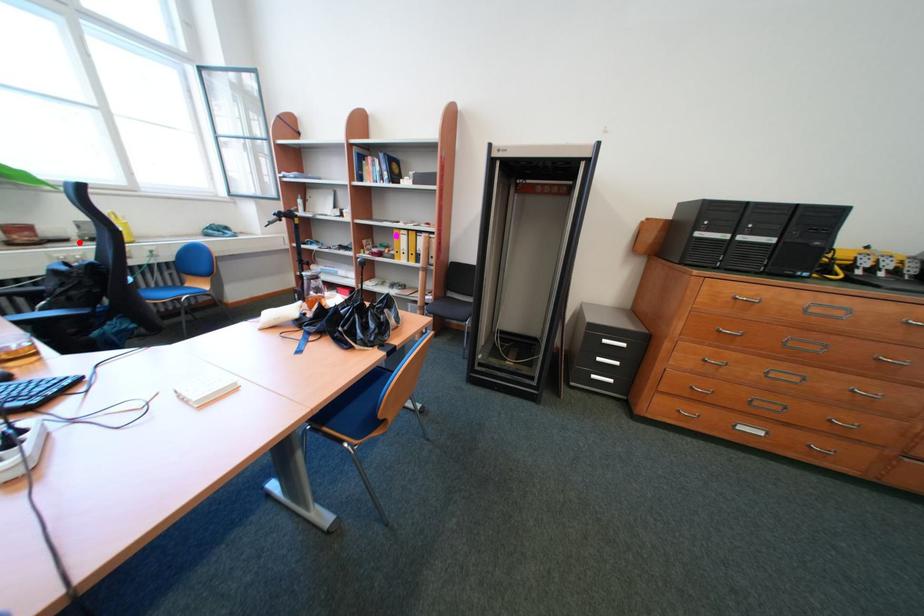
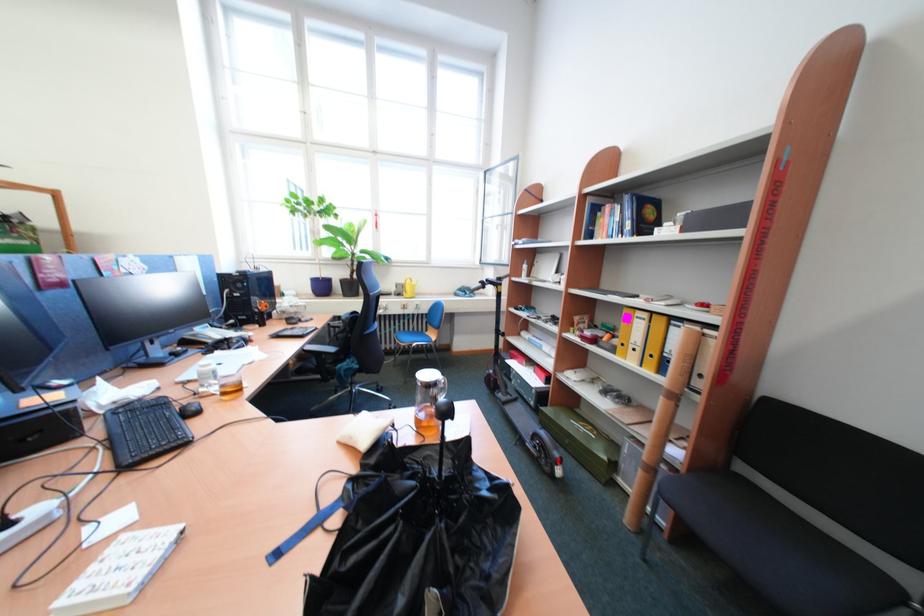
Find the pixel in the second image that matches the highlighted location in the first image.

(403, 296)